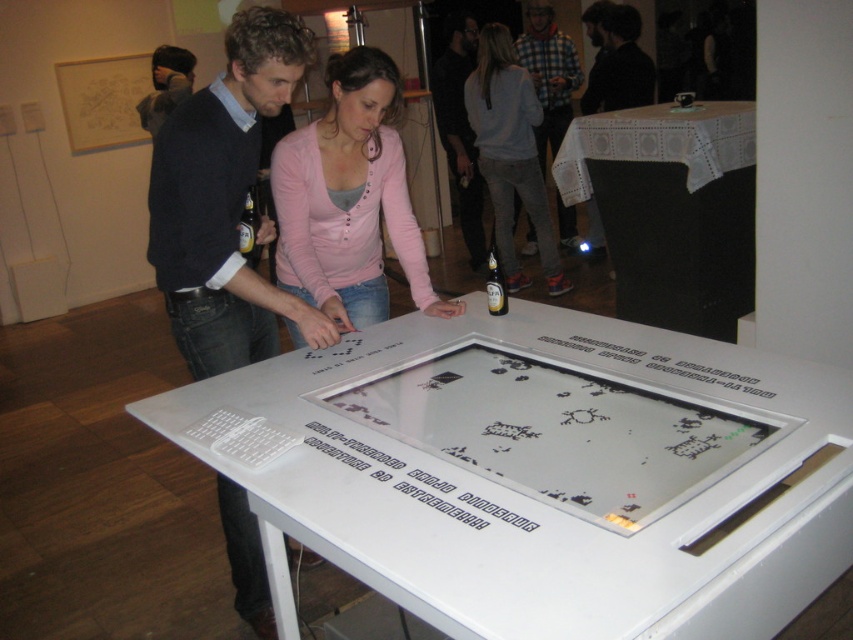
You are standing in front of the table in the exhibition space. You see two points on the glass surface labeled as point (711, 266) and point (490, 296). Which point is closer to you?

Point (490, 296) is closer to you because it is in front of point (711, 266).

You are standing at the entrance of the exhibition space and see the white plastic game at center and the white lace tablecloth at upper right. Which object is closer to your right side?

The white lace tablecloth at upper right is closer to your right side because it is positioned to the right of the white plastic game at center.